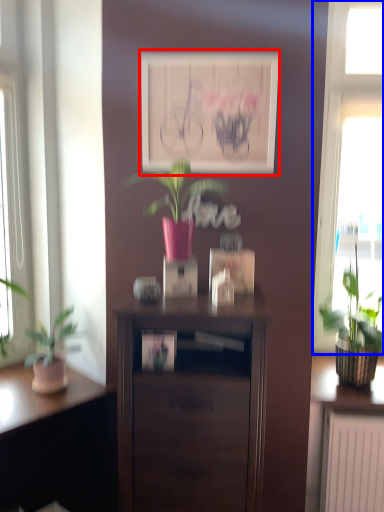
Question: Which object appears closest to the camera in this image, picture frame (highlighted by a red box) or window (highlighted by a blue box)?

Choices:
 (A) picture frame
 (B) window

Answer: (A)